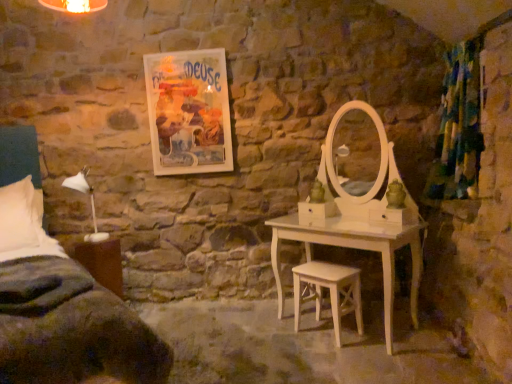
What do you see at coordinates (329, 292) in the screenshot? I see `white wood stool at center` at bounding box center [329, 292].

What are the coordinates of `brown wood nightstand at lower left` in the screenshot? It's located at (102, 262).

From their relative heights in the image, would you say textured green curtain at right is taller or shorter than white wood stool at center?

Considering their sizes, textured green curtain at right has more height than white wood stool at center.

Is textured green curtain at right not near white wood stool at center?

Indeed, textured green curtain at right is not near white wood stool at center.

Can you confirm if textured green curtain at right is positioned to the right of white wood stool at center?

Yes.

Which point is more distant from viewer, (467,76) or (74,175)?

The point (74,175) is more distant.

Is textured green curtain at right outside of white matte table lamp at left?

Yes, textured green curtain at right is not within white matte table lamp at left.

Locate an element on the screen. table lamp below the textured green curtain at right (from the image's perspective) is located at coordinates (90, 202).

In the scene shown: Which of these two, textured green curtain at right or white matte table lamp at left, is wider?

white matte table lamp at left is wider.

Is brown wood nightstand at lower left oriented away from matte paper poster at upper center?

No, brown wood nightstand at lower left is not facing away from matte paper poster at upper center.

Considering the points (120, 271) and (207, 89), which point is in front, point (120, 271) or point (207, 89)?

The point (120, 271) is in front.

Between brown wood nightstand at lower left and matte paper poster at upper center, which one appears on the left side from the viewer's perspective?

From the viewer's perspective, brown wood nightstand at lower left appears more on the left side.

Are brown wood nightstand at lower left and matte paper poster at upper center located far from each other?

That's right, there is a large distance between brown wood nightstand at lower left and matte paper poster at upper center.

From the image's perspective, which one is positioned higher, white matte table lamp at left or white wood stool at center?

white matte table lamp at left is shown above in the image.

Is white matte table lamp at left not inside white wood stool at center?

white matte table lamp at left lies outside white wood stool at center's area.

Which object is closer to the camera taking this photo, white matte table lamp at left or white wood stool at center?

white wood stool at center is in front.

Is point (95, 229) farther from viewer compared to point (362, 328)?

Yes.

From the image's perspective, is white wood stool at center located beneath dark green fabric bed at left?

Yes, from the image's perspective, white wood stool at center is below dark green fabric bed at left.

Is the position of white wood stool at center more distant than that of dark green fabric bed at left?

Yes, white wood stool at center is behind dark green fabric bed at left.

Is white wood stool at center turned away from dark green fabric bed at left?

No, white wood stool at center is not facing away from dark green fabric bed at left.

Based on the photo, considering the positions of objects white wood stool at center and dark green fabric bed at left in the image provided, who is more to the left, white wood stool at center or dark green fabric bed at left?

dark green fabric bed at left is more to the left.

Is textured green curtain at right oriented towards brown wood nightstand at lower left?

Yes, textured green curtain at right is facing brown wood nightstand at lower left.

At what (x,y) coordinates should I click in order to perform the action: click on curtain in front of the brown wood nightstand at lower left. Please return your answer as a coordinate pair (x, y). The image size is (512, 384). Looking at the image, I should click on (458, 126).

Are textured green curtain at right and brown wood nightstand at lower left far apart?

textured green curtain at right is far away from brown wood nightstand at lower left.

Which point is more forward, [466,74] or [84,244]?

Positioned in front is point [466,74].

Based on the photo, which point is more distant from viewer, (x=298, y=327) or (x=100, y=235)?

Point (x=100, y=235)

I want to click on table lamp that appears above the white wood stool at center (from the image's perspective), so click(90, 202).

Could you tell me if white wood stool at center is turned towards white matte table lamp at left?

No, white wood stool at center is not aimed at white matte table lamp at left.

From a real-world perspective, does white wood stool at center stand above white matte table lamp at left?

Incorrect, from a real-world perspective, white wood stool at center is lower than white matte table lamp at left.

Identify the location of stool below the textured green curtain at right (from the image's perspective). Image resolution: width=512 pixels, height=384 pixels. (329, 292).

Image resolution: width=512 pixels, height=384 pixels. What are the coordinates of `table lamp located underneath the textured green curtain at right (from a real-world perspective)` in the screenshot? It's located at (90, 202).

Estimate the real-world distances between objects in this image. Which object is further from white wood stool at center, matte paper poster at upper center or brown wood nightstand at lower left?

brown wood nightstand at lower left lies further to white wood stool at center than the other object.

Which object lies further to the anchor point dark green fabric bed at left, brown wood nightstand at lower left or white matte table lamp at left?

white matte table lamp at left.

Considering their positions, is matte paper poster at upper center positioned further to brown wood nightstand at lower left than white matte table lamp at left?

matte paper poster at upper center is positioned further to the anchor brown wood nightstand at lower left.

Which object lies further to the anchor point white matte table lamp at left, matte paper poster at upper center or textured green curtain at right?

textured green curtain at right lies further to white matte table lamp at left than the other object.

Estimate the real-world distances between objects in this image. Which object is closer to textured green curtain at right, white matte table lamp at left or white wood stool at center?

white wood stool at center lies closer to textured green curtain at right than the other object.

Looking at the image, which one is located closer to brown wood nightstand at lower left, dark green fabric bed at left or matte paper poster at upper center?

dark green fabric bed at left is closer to brown wood nightstand at lower left.

Based on their spatial positions, is textured green curtain at right or white wood stool at center closer to dark green fabric bed at left?

white wood stool at center is closer to dark green fabric bed at left.

Which object lies further to the anchor point white wood stool at center, white matte table lamp at left or dark green fabric bed at left?

white matte table lamp at left.

At what (x,y) coordinates should I click in order to perform the action: click on picture frame between brown wood nightstand at lower left and textured green curtain at right. Please return your answer as a coordinate pair (x, y). Looking at the image, I should click on (189, 112).

Identify the location of picture frame between white matte table lamp at left and textured green curtain at right from left to right. coord(189,112).

Find the location of a particular element. table lamp between matte paper poster at upper center and brown wood nightstand at lower left from top to bottom is located at coordinates (90, 202).

Locate an element on the screen. table lamp between dark green fabric bed at left and matte paper poster at upper center along the z-axis is located at coordinates (90, 202).